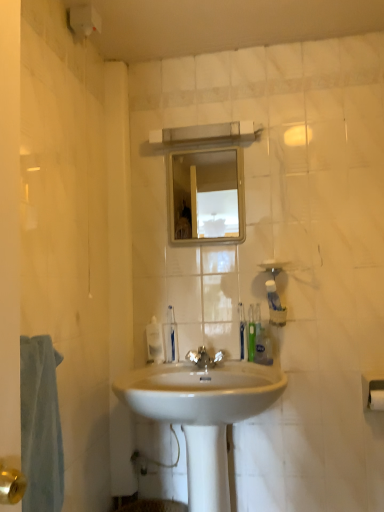
Question: Considering the positions of white matte soap at center and green plastic toothbrush at center, marked as the 2th toiletry in a left-to-right arrangement, in the image, is white matte soap at center wider or thinner than green plastic toothbrush at center, marked as the 2th toiletry in a left-to-right arrangement,?

Choices:
 (A) thin
 (B) wide

Answer: (B)

Question: Is white matte soap at center taller or shorter than green plastic toothbrush at center, marked as the fourth toiletry in a right-to-left arrangement?

Choices:
 (A) short
 (B) tall

Answer: (A)

Question: Estimate the real-world distances between objects in this image. Which object is farther from the polished chrome faucet at center?

Choices:
 (A) white matte toilet paper at lower right
 (B) green plastic toothbrush at right, arranged as the 3th toiletry when viewed from the right
 (C) green matte toothpaste tube at center, marked as the fourth toiletry in a left-to-right arrangement
 (D) white glossy sink at center
 (E) white matte soap at center

Answer: (A)

Question: Estimate the real-world distances between objects in this image. Which object is farther from the green matte toothpaste tube at center, which is counted as the 2th toiletry, starting from the right?

Choices:
 (A) white glossy sink at center
 (B) translucent plastic soap dispenser at center
 (C) clear glass mirror at upper center
 (D) translucent plastic soap dispenser at upper right, which ranks as the 1th toiletry in right-to-left order
 (E) white plastic toothbrush at center, which is counted as the 1th toiletry, starting from the left

Answer: (C)